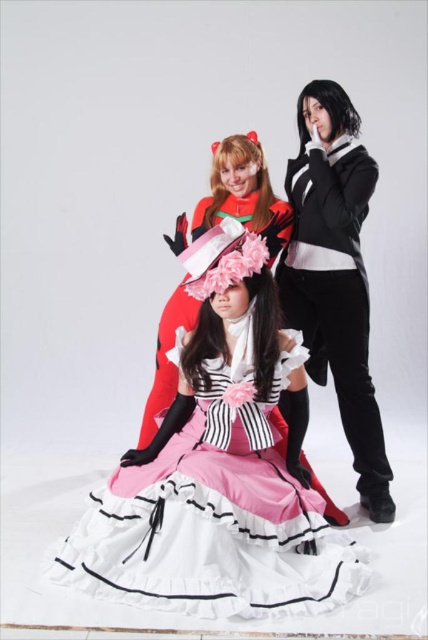
Can you confirm if matte pink dress at center is positioned to the left of matte black dress at center?

No, matte pink dress at center is not to the left of matte black dress at center.

Does matte pink dress at center appear over matte black dress at center?

No.

Is point (204, 388) closer to viewer compared to point (196, 230)?

Yes.

You are a GUI agent. You are given a task and a screenshot of the screen. Output one action in this format:
    pyautogui.click(x=<x>, y=<y>)
    Task: Click on the matte pink dress at center
    
    Given the screenshot: What is the action you would take?
    pyautogui.click(x=219, y=467)

Does matte pink dress at center appear over black matte jacket at center?

No, matte pink dress at center is not above black matte jacket at center.

Can you confirm if matte pink dress at center is shorter than black matte jacket at center?

Indeed, matte pink dress at center has a lesser height compared to black matte jacket at center.

At what (x,y) coordinates should I click in order to perform the action: click on matte pink dress at center. Please return your answer as a coordinate pair (x, y). The height and width of the screenshot is (640, 428). Looking at the image, I should click on (219, 467).

In order to click on black matte jacket at center in this screenshot , I will do `click(335, 275)`.

Is point (318, 88) more distant than point (282, 424)?

Yes.

Does point (357, 120) come behind point (169, 241)?

Yes, point (357, 120) is behind point (169, 241).

This screenshot has width=428, height=640. In order to click on black matte jacket at center in this screenshot , I will do `click(335, 275)`.